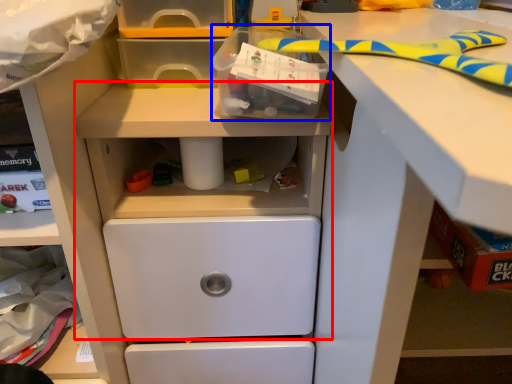
Question: Which of the following is the closest to the observer, workbench (highlighted by a red box) or box (highlighted by a blue box)?

Choices:
 (A) workbench
 (B) box

Answer: (B)